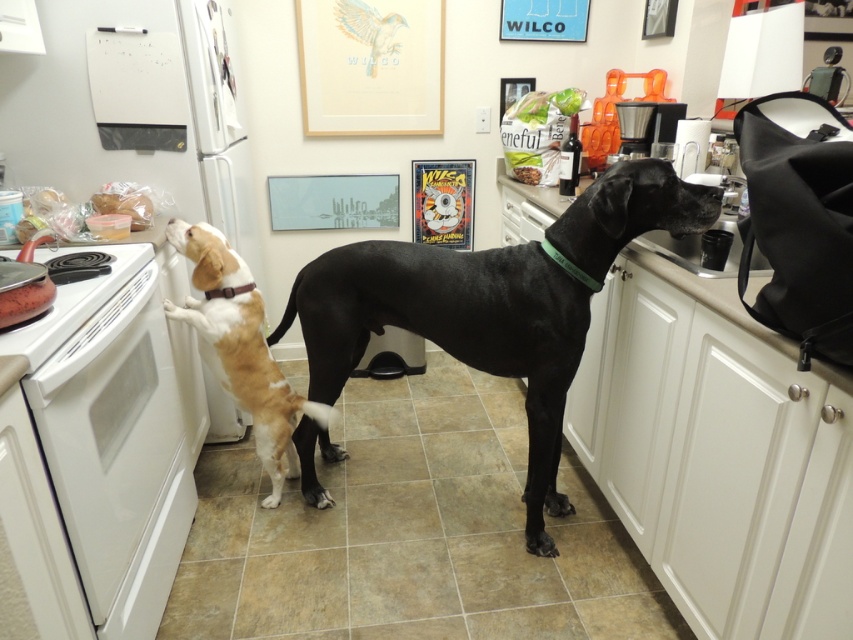
Question: Is white glossy oven at left to the right of light brown fur at left from the viewer's perspective?

Choices:
 (A) no
 (B) yes

Answer: (A)

Question: Based on their relative distances, which object is nearer to the white glossy countertop at right?

Choices:
 (A) black plastic coffee maker at upper right
 (B) light brown fur at left

Answer: (A)

Question: Is black smooth coat dog at center positioned at the back of white glossy countertop at right?

Choices:
 (A) yes
 (B) no

Answer: (B)

Question: Which point is farther to the camera?

Choices:
 (A) tap(177, 108)
 (B) tap(167, 433)
 (C) tap(844, 378)
 (D) tap(618, 120)

Answer: (D)

Question: Which object is the closest to the white glossy oven at left?

Choices:
 (A) white matte exhaust hood at upper left
 (B) white glossy countertop at right
 (C) black plastic coffee maker at upper right
 (D) black smooth coat dog at center

Answer: (D)

Question: Where is black smooth coat dog at center located in relation to white matte exhaust hood at upper left in the image?

Choices:
 (A) right
 (B) left

Answer: (A)